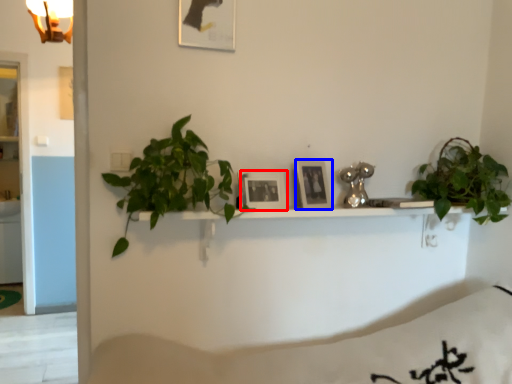
Question: Among these objects, which one is farthest to the camera, picture frame (highlighted by a red box) or picture frame (highlighted by a blue box)?

Choices:
 (A) picture frame
 (B) picture frame

Answer: (B)